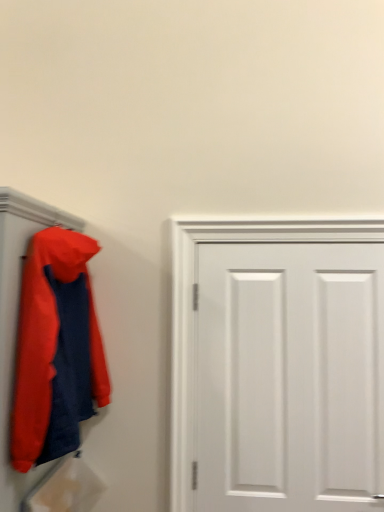
Describe the element at coordinates (289, 375) in the screenshot. This screenshot has width=384, height=512. I see `white matte door at center` at that location.

At what (x,y) coordinates should I click in order to perform the action: click on white matte door at center. Please return your answer as a coordinate pair (x, y). Looking at the image, I should click on (289, 375).

Measure the distance between point (320, 326) and camera.

Point (320, 326) and camera are 5.73 feet apart from each other.

Measure the distance between matte orange jacket at left and camera.

matte orange jacket at left is 4.10 feet away from camera.

The height and width of the screenshot is (512, 384). What do you see at coordinates (56, 349) in the screenshot?
I see `matte orange jacket at left` at bounding box center [56, 349].

You are a GUI agent. You are given a task and a screenshot of the screen. Output one action in this format:
    pyautogui.click(x=<x>, y=<y>)
    Task: Click on the matte orange jacket at left
    
    Given the screenshot: What is the action you would take?
    pyautogui.click(x=56, y=349)

The image size is (384, 512). I want to click on white matte door at center, so 289,375.

Which is more to the right, matte orange jacket at left or white matte door at center?

From the viewer's perspective, white matte door at center appears more on the right side.

Does matte orange jacket at left come in front of white matte door at center?

Yes, it is.

Considering the positions of point (59, 261) and point (215, 435), is point (59, 261) closer or farther from the camera than point (215, 435)?

Point (59, 261) is positioned closer to the camera compared to point (215, 435).

From the picture: From the image's perspective, who appears lower, matte orange jacket at left or white matte door at center?

white matte door at center.

From a real-world perspective, which is physically above, matte orange jacket at left or white matte door at center?

matte orange jacket at left is physically above.

Considering the relative sizes of matte orange jacket at left and white matte door at center in the image provided, is matte orange jacket at left wider than white matte door at center?

Yes.

Which of these two, matte orange jacket at left or white matte door at center, stands taller?

Standing taller between the two is white matte door at center.

Considering the relative sizes of matte orange jacket at left and white matte door at center in the image provided, is matte orange jacket at left smaller than white matte door at center?

Actually, matte orange jacket at left might be larger than white matte door at center.

Is white matte door at center located within matte orange jacket at left?

No.

Are matte orange jacket at left and white matte door at center beside each other?

No.

Is matte orange jacket at left facing away from white matte door at center?

No, matte orange jacket at left is not facing the opposite direction of white matte door at center.

How different are the orientations of matte orange jacket at left and white matte door at center in degrees?

The facing directions of matte orange jacket at left and white matte door at center are 0.159 degrees apart.

This screenshot has width=384, height=512. In order to click on door below the matte orange jacket at left (from a real-world perspective) in this screenshot , I will do `click(289, 375)`.

Can you confirm if white matte door at center is positioned to the left of matte orange jacket at left?

No.

Is the depth of white matte door at center greater than that of matte orange jacket at left?

Yes, white matte door at center is behind matte orange jacket at left.

Is point (201, 438) closer to viewer compared to point (33, 401)?

No, (201, 438) is further to viewer.

From the image's perspective, which one is positioned lower, white matte door at center or matte orange jacket at left?

white matte door at center, from the image's perspective.

From a real-world perspective, does white matte door at center stand above matte orange jacket at left?

Incorrect, from a real-world perspective, white matte door at center is lower than matte orange jacket at left.

Which object is thinner, white matte door at center or matte orange jacket at left?

With smaller width is white matte door at center.

Is white matte door at center taller than matte orange jacket at left?

Yes, white matte door at center is taller than matte orange jacket at left.

Is white matte door at center bigger than matte orange jacket at left?

Actually, white matte door at center might be smaller than matte orange jacket at left.

Would you say white matte door at center is outside matte orange jacket at left?

Yes, white matte door at center is not within matte orange jacket at left.

Is white matte door at center not close to matte orange jacket at left?

white matte door at center is near matte orange jacket at left, not far away.

Could you tell me if white matte door at center is turned towards matte orange jacket at left?

No, white matte door at center is not facing towards matte orange jacket at left.

How different are the orientations of white matte door at center and matte orange jacket at left in degrees?

The angular difference between white matte door at center and matte orange jacket at left is 0.159 degrees.

This screenshot has width=384, height=512. In order to click on door directly beneath the matte orange jacket at left (from a real-world perspective) in this screenshot , I will do `click(289, 375)`.

Image resolution: width=384 pixels, height=512 pixels. Identify the location of door behind the matte orange jacket at left. (289, 375).

Locate an element on the screen. This screenshot has height=512, width=384. door on the right of matte orange jacket at left is located at coordinates (289, 375).